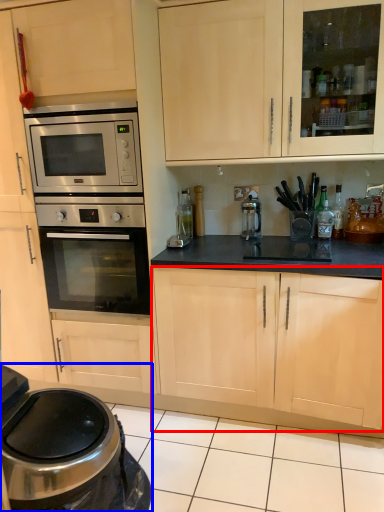
Question: Which object appears farthest to the camera in this image, cabinetry (highlighted by a red box) or home appliance (highlighted by a blue box)?

Choices:
 (A) cabinetry
 (B) home appliance

Answer: (A)